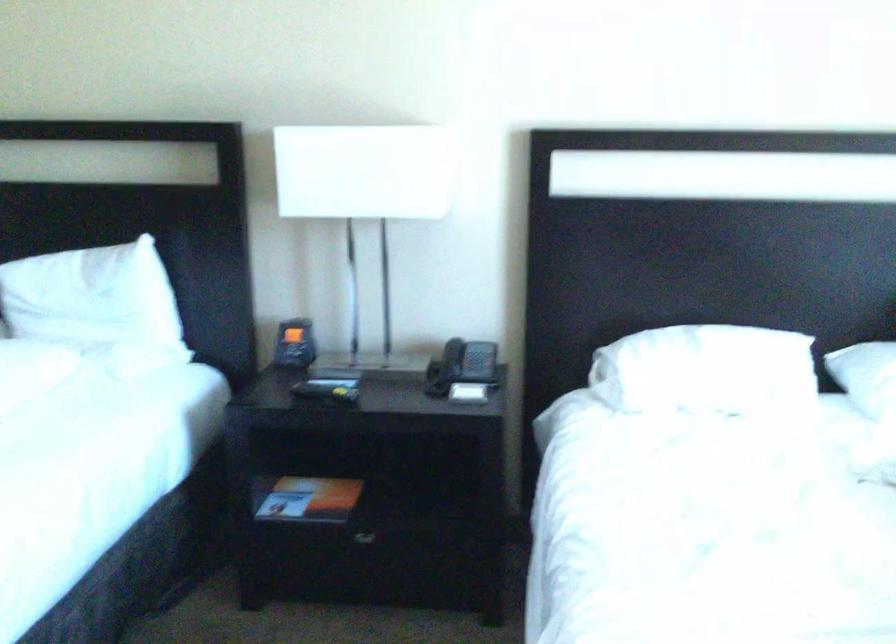
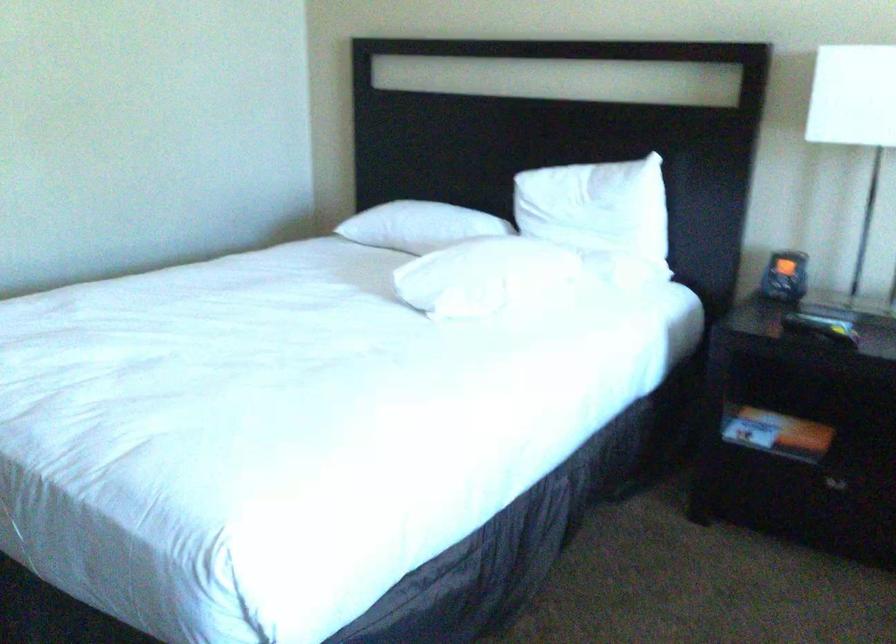
Question: How did the camera likely rotate?

Choices:
 (A) Left
 (B) Right
 (C) Up
 (D) Down

Answer: (A)